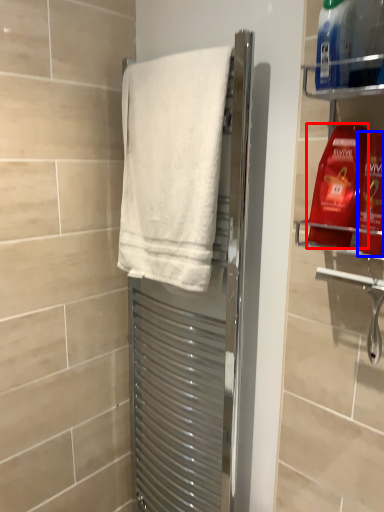
Question: Which of the following is the closest to the observer, cleaning product (highlighted by a red box) or cleaning product (highlighted by a blue box)?

Choices:
 (A) cleaning product
 (B) cleaning product

Answer: (B)